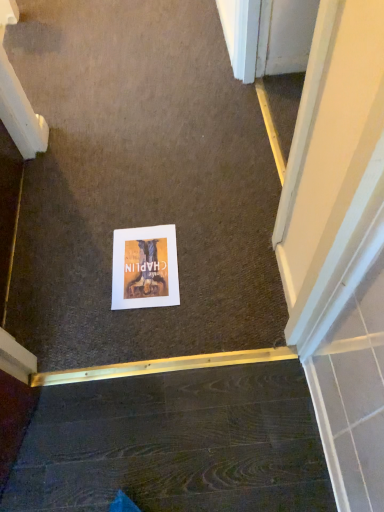
Find the location of `free spot to the left of white paper at center`. free spot to the left of white paper at center is located at coordinates point(77,280).